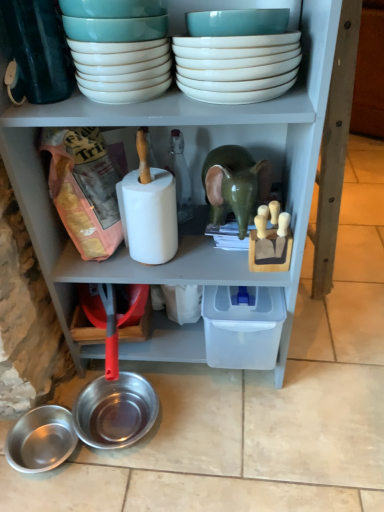
This screenshot has height=512, width=384. Describe the element at coordinates (41, 439) in the screenshot. I see `shiny metallic bowl at lower left, arranged as the first bowl when ordered from the bottom` at that location.

I want to click on shiny metallic bowl at lower left, acting as the third bowl starting from the top, so click(x=115, y=411).

What is the approximate width of white glossy bowls at upper center, which ranks as the 4th bowl in bottom-to-top order?

white glossy bowls at upper center, which ranks as the 4th bowl in bottom-to-top order, is 10.14 inches wide.

This screenshot has height=512, width=384. What do you see at coordinates (123, 70) in the screenshot?
I see `white glossy bowls at upper center, placed as the 3th bowl when sorted from bottom to top` at bounding box center [123, 70].

The image size is (384, 512). What are the coordinates of `shiny metallic bowl at lower left, arranged as the first bowl when ordered from the bottom` in the screenshot? It's located at (41, 439).

Is point (87, 389) positioned after point (53, 464)?

Yes, point (87, 389) is behind point (53, 464).

Is shiny metallic bowl at lower left, which ranks as the second bowl in bottom-to-top order, inside the boundaries of shiny metallic bowl at lower left, the fourth bowl viewed from the top, or outside?

shiny metallic bowl at lower left, which ranks as the second bowl in bottom-to-top order, is located beyond the bounds of shiny metallic bowl at lower left, the fourth bowl viewed from the top.

Is shiny metallic bowl at lower left, acting as the third bowl starting from the top, facing away from shiny metallic bowl at lower left, arranged as the first bowl when ordered from the bottom?

That's right, shiny metallic bowl at lower left, acting as the third bowl starting from the top, is facing away from shiny metallic bowl at lower left, arranged as the first bowl when ordered from the bottom.

In terms of height, does shiny metallic bowl at lower left, acting as the third bowl starting from the top, look taller or shorter compared to shiny metallic bowl at lower left, arranged as the first bowl when ordered from the bottom?

shiny metallic bowl at lower left, acting as the third bowl starting from the top, is taller than shiny metallic bowl at lower left, arranged as the first bowl when ordered from the bottom.

Is shiny metallic bowl at lower left, the fourth bowl viewed from the top, inside the boundaries of shiny metallic bowl at lower left, which ranks as the second bowl in bottom-to-top order, or outside?

The correct answer is: outside.

From the image's perspective, which one is positioned lower, shiny metallic bowl at lower left, the fourth bowl viewed from the top, or shiny metallic bowl at lower left, which ranks as the second bowl in bottom-to-top order?

From the image's view, shiny metallic bowl at lower left, the fourth bowl viewed from the top, is below.

From a real-world perspective, is shiny metallic bowl at lower left, arranged as the first bowl when ordered from the bottom, physically above shiny metallic bowl at lower left, which ranks as the second bowl in bottom-to-top order?

No, from a real-world perspective, shiny metallic bowl at lower left, arranged as the first bowl when ordered from the bottom, is not over shiny metallic bowl at lower left, which ranks as the second bowl in bottom-to-top order

From the image's perspective, which is below, shiny metallic bowl at lower left, arranged as the first bowl when ordered from the bottom, or white glossy bowls at upper center, placed as the 3th bowl when sorted from bottom to top?

shiny metallic bowl at lower left, arranged as the first bowl when ordered from the bottom.

Considering the sizes of objects shiny metallic bowl at lower left, arranged as the first bowl when ordered from the bottom, and white glossy bowls at upper center, the 2th bowl viewed from the top, in the image provided, who is smaller, shiny metallic bowl at lower left, arranged as the first bowl when ordered from the bottom, or white glossy bowls at upper center, the 2th bowl viewed from the top,?

shiny metallic bowl at lower left, arranged as the first bowl when ordered from the bottom, is smaller.

Is shiny metallic bowl at lower left, arranged as the first bowl when ordered from the bottom, facing away from white glossy bowls at upper center, placed as the 3th bowl when sorted from bottom to top?

That's not correct — shiny metallic bowl at lower left, arranged as the first bowl when ordered from the bottom, is not looking away from white glossy bowls at upper center, placed as the 3th bowl when sorted from bottom to top.

Is white glossy bowls at upper center, placed as the 3th bowl when sorted from bottom to top, closer to camera compared to shiny metallic bowl at lower left, acting as the third bowl starting from the top?

Yes, it is.

From a real-world perspective, who is located lower, white glossy bowls at upper center, placed as the 3th bowl when sorted from bottom to top, or shiny metallic bowl at lower left, which ranks as the second bowl in bottom-to-top order?

From a 3D spatial view, shiny metallic bowl at lower left, which ranks as the second bowl in bottom-to-top order, is below.

What's the angular difference between white glossy bowls at upper center, placed as the 3th bowl when sorted from bottom to top, and shiny metallic bowl at lower left, acting as the third bowl starting from the top,'s facing directions?

The facing directions of white glossy bowls at upper center, placed as the 3th bowl when sorted from bottom to top, and shiny metallic bowl at lower left, acting as the third bowl starting from the top, are 89.9 degrees apart.

Is white glossy bowls at upper center, placed as the 3th bowl when sorted from bottom to top, at the left side of shiny metallic bowl at lower left, acting as the third bowl starting from the top?

Incorrect, white glossy bowls at upper center, placed as the 3th bowl when sorted from bottom to top, is not on the left side of shiny metallic bowl at lower left, acting as the third bowl starting from the top.

Is shiny metallic bowl at lower left, arranged as the first bowl when ordered from the bottom, at the back of white glossy bowls at upper center, which ranks as the 4th bowl in bottom-to-top order?

That's not correct — white glossy bowls at upper center, which ranks as the 4th bowl in bottom-to-top order, is not looking away from shiny metallic bowl at lower left, arranged as the first bowl when ordered from the bottom.

In the image, is white glossy bowls at upper center, which ranks as the 4th bowl in bottom-to-top order, on the left side or the right side of shiny metallic bowl at lower left, the fourth bowl viewed from the top?

white glossy bowls at upper center, which ranks as the 4th bowl in bottom-to-top order, is positioned on shiny metallic bowl at lower left, the fourth bowl viewed from the top,'s right side.

Which is behind, point (196, 47) or point (27, 422)?

The point (27, 422) is behind.

Who is shorter, white glossy bowls at upper center, which ranks as the 4th bowl in bottom-to-top order, or shiny metallic bowl at lower left, the fourth bowl viewed from the top?

shiny metallic bowl at lower left, the fourth bowl viewed from the top, is shorter.

Measure the distance between white glossy bowls at upper center, placed as the 3th bowl when sorted from bottom to top, and shiny metallic bowl at lower left, arranged as the first bowl when ordered from the bottom.

white glossy bowls at upper center, placed as the 3th bowl when sorted from bottom to top, is 37.52 inches away from shiny metallic bowl at lower left, arranged as the first bowl when ordered from the bottom.

Does white glossy bowls at upper center, placed as the 3th bowl when sorted from bottom to top, turn towards shiny metallic bowl at lower left, arranged as the first bowl when ordered from the bottom?

No, white glossy bowls at upper center, placed as the 3th bowl when sorted from bottom to top, is not oriented towards shiny metallic bowl at lower left, arranged as the first bowl when ordered from the bottom.

Where is `bowl that is the 2nd one when counting downward from the white glossy bowls at upper center, the 2th bowl viewed from the top (from the image's perspective)`? bowl that is the 2nd one when counting downward from the white glossy bowls at upper center, the 2th bowl viewed from the top (from the image's perspective) is located at coordinates (41, 439).

Considering the sizes of white glossy bowls at upper center, placed as the 3th bowl when sorted from bottom to top, and shiny metallic bowl at lower left, the fourth bowl viewed from the top, in the image, is white glossy bowls at upper center, placed as the 3th bowl when sorted from bottom to top, taller or shorter than shiny metallic bowl at lower left, the fourth bowl viewed from the top,?

Considering their sizes, white glossy bowls at upper center, placed as the 3th bowl when sorted from bottom to top, has more height than shiny metallic bowl at lower left, the fourth bowl viewed from the top.

Is shiny metallic bowl at lower left, which ranks as the second bowl in bottom-to-top order, surrounded by white glossy bowls at upper center, which ranks as the 4th bowl in bottom-to-top order?

No, shiny metallic bowl at lower left, which ranks as the second bowl in bottom-to-top order, is located outside of white glossy bowls at upper center, which ranks as the 4th bowl in bottom-to-top order.

From the image's perspective, is white glossy bowls at upper center, which ranks as the 4th bowl in bottom-to-top order, on shiny metallic bowl at lower left, which ranks as the second bowl in bottom-to-top order?

Yes, from the image's perspective, white glossy bowls at upper center, which ranks as the 4th bowl in bottom-to-top order, is above shiny metallic bowl at lower left, which ranks as the second bowl in bottom-to-top order.

From a real-world perspective, between white glossy bowls at upper center, which is counted as the 1th bowl, starting from the top, and shiny metallic bowl at lower left, acting as the third bowl starting from the top, who is vertically higher?

white glossy bowls at upper center, which is counted as the 1th bowl, starting from the top.

This screenshot has height=512, width=384. What are the coordinates of `bowl lying below the shiny metallic bowl at lower left, which ranks as the second bowl in bottom-to-top order (from the image's perspective)` in the screenshot? It's located at (41, 439).

This screenshot has width=384, height=512. Find the location of `bowl lying behind the shiny metallic bowl at lower left, arranged as the first bowl when ordered from the bottom`. bowl lying behind the shiny metallic bowl at lower left, arranged as the first bowl when ordered from the bottom is located at coordinates (115, 411).

When comparing their distances from white glossy bowls at upper center, which ranks as the 4th bowl in bottom-to-top order, does shiny metallic bowl at lower left, acting as the third bowl starting from the top, or white glossy bowls at upper center, the 2th bowl viewed from the top, seem further?

shiny metallic bowl at lower left, acting as the third bowl starting from the top, is positioned further to the anchor white glossy bowls at upper center, which ranks as the 4th bowl in bottom-to-top order.

Which object lies nearer to the anchor point white glossy bowls at upper center, the 2th bowl viewed from the top, shiny metallic bowl at lower left, arranged as the first bowl when ordered from the bottom, or shiny metallic bowl at lower left, acting as the third bowl starting from the top?

shiny metallic bowl at lower left, acting as the third bowl starting from the top, is closer to white glossy bowls at upper center, the 2th bowl viewed from the top.

Considering their positions, is shiny metallic bowl at lower left, which ranks as the second bowl in bottom-to-top order, positioned further to white glossy bowls at upper center, which is counted as the 1th bowl, starting from the top, than shiny metallic bowl at lower left, the fourth bowl viewed from the top?

Based on the image, shiny metallic bowl at lower left, the fourth bowl viewed from the top, appears to be further to white glossy bowls at upper center, which is counted as the 1th bowl, starting from the top.

Based on the photo, when comparing their distances from white glossy bowls at upper center, placed as the 3th bowl when sorted from bottom to top, does shiny metallic bowl at lower left, acting as the third bowl starting from the top, or shiny metallic bowl at lower left, arranged as the first bowl when ordered from the bottom, seem further?

Based on the image, shiny metallic bowl at lower left, arranged as the first bowl when ordered from the bottom, appears to be further to white glossy bowls at upper center, placed as the 3th bowl when sorted from bottom to top.

Estimate the real-world distances between objects in this image. Which object is closer to shiny metallic bowl at lower left, arranged as the first bowl when ordered from the bottom, white glossy bowls at upper center, the 2th bowl viewed from the top, or white glossy bowls at upper center, which ranks as the 4th bowl in bottom-to-top order?

white glossy bowls at upper center, the 2th bowl viewed from the top.

Estimate the real-world distances between objects in this image. Which object is further from white glossy bowls at upper center, which ranks as the 4th bowl in bottom-to-top order, white glossy bowls at upper center, the 2th bowl viewed from the top, or shiny metallic bowl at lower left, arranged as the first bowl when ordered from the bottom?

shiny metallic bowl at lower left, arranged as the first bowl when ordered from the bottom, lies further to white glossy bowls at upper center, which ranks as the 4th bowl in bottom-to-top order, than the other object.

From the image, which object appears to be farther from white glossy bowls at upper center, placed as the 3th bowl when sorted from bottom to top, white glossy bowls at upper center, which ranks as the 4th bowl in bottom-to-top order, or shiny metallic bowl at lower left, acting as the third bowl starting from the top?

shiny metallic bowl at lower left, acting as the third bowl starting from the top, is positioned further to the anchor white glossy bowls at upper center, placed as the 3th bowl when sorted from bottom to top.

Looking at the image, which one is located closer to shiny metallic bowl at lower left, acting as the third bowl starting from the top, white glossy bowls at upper center, the 2th bowl viewed from the top, or shiny metallic bowl at lower left, arranged as the first bowl when ordered from the bottom?

The object closer to shiny metallic bowl at lower left, acting as the third bowl starting from the top, is shiny metallic bowl at lower left, arranged as the first bowl when ordered from the bottom.

The image size is (384, 512). Identify the location of bowl between white glossy bowls at upper center, placed as the 3th bowl when sorted from bottom to top, and shiny metallic bowl at lower left, the fourth bowl viewed from the top, from top to bottom. 115,411.

Locate an element on the screen. This screenshot has width=384, height=512. bowl between white glossy bowls at upper center, which ranks as the 4th bowl in bottom-to-top order, and shiny metallic bowl at lower left, which ranks as the second bowl in bottom-to-top order, in the vertical direction is located at coordinates (123, 70).